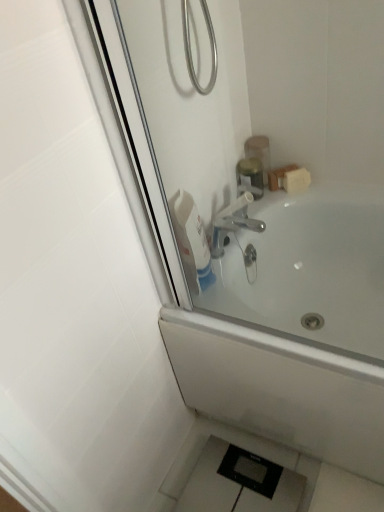
Question: Can we say white glossy bottle at upper center lies outside metallic silver soap dispenser at upper right, which ranks as the second toiletry in top-to-bottom order?

Choices:
 (A) yes
 (B) no

Answer: (A)

Question: Does white glossy bottle at upper center have a greater height compared to metallic silver soap dispenser at upper right, arranged as the first toiletry when ordered from the bottom?

Choices:
 (A) no
 (B) yes

Answer: (B)

Question: Are white glossy bottle at upper center and metallic silver soap dispenser at upper right, which ranks as the second toiletry in top-to-bottom order, making contact?

Choices:
 (A) no
 (B) yes

Answer: (A)

Question: From the image's perspective, is white glossy bottle at upper center on metallic silver soap dispenser at upper right, arranged as the first toiletry when ordered from the bottom?

Choices:
 (A) no
 (B) yes

Answer: (A)

Question: Does white glossy bottle at upper center have a larger size compared to metallic silver soap dispenser at upper right, which ranks as the second toiletry in top-to-bottom order?

Choices:
 (A) no
 (B) yes

Answer: (B)

Question: From the image's perspective, relative to white glossy bottle at upper center, is metallic gold container at upper center, which is the first toiletry in top-to-bottom order, above or below?

Choices:
 (A) below
 (B) above

Answer: (B)

Question: Does point (264, 177) appear closer or farther from the camera than point (193, 240)?

Choices:
 (A) farther
 (B) closer

Answer: (A)

Question: Considering the positions of metallic gold container at upper center, which is the first toiletry in top-to-bottom order, and white glossy bottle at upper center in the image, is metallic gold container at upper center, which is the first toiletry in top-to-bottom order, taller or shorter than white glossy bottle at upper center?

Choices:
 (A) tall
 (B) short

Answer: (B)

Question: Considering the positions of metallic gold container at upper center, which is the first toiletry in top-to-bottom order, and white glossy bottle at upper center in the image, is metallic gold container at upper center, which is the first toiletry in top-to-bottom order, wider or thinner than white glossy bottle at upper center?

Choices:
 (A) thin
 (B) wide

Answer: (B)

Question: Would you say metallic gold container at upper center, which is the first toiletry in top-to-bottom order, is inside or outside white glossy bathtub at upper center?

Choices:
 (A) inside
 (B) outside

Answer: (B)

Question: Is metallic gold container at upper center, marked as the second toiletry in a bottom-to-top arrangement, wider or thinner than white glossy bathtub at upper center?

Choices:
 (A) wide
 (B) thin

Answer: (B)

Question: Is metallic gold container at upper center, which is the first toiletry in top-to-bottom order, in front of or behind white glossy bathtub at upper center in the image?

Choices:
 (A) front
 (B) behind

Answer: (B)

Question: From a real-world perspective, is metallic gold container at upper center, which is the first toiletry in top-to-bottom order, above or below white glossy bathtub at upper center?

Choices:
 (A) below
 (B) above

Answer: (B)

Question: Considering the relative positions of white glossy bathtub at upper center and white glossy bottle at upper center in the image provided, is white glossy bathtub at upper center to the left or to the right of white glossy bottle at upper center?

Choices:
 (A) left
 (B) right

Answer: (B)

Question: In the image, is white glossy bathtub at upper center positioned in front of or behind white glossy bottle at upper center?

Choices:
 (A) behind
 (B) front

Answer: (B)